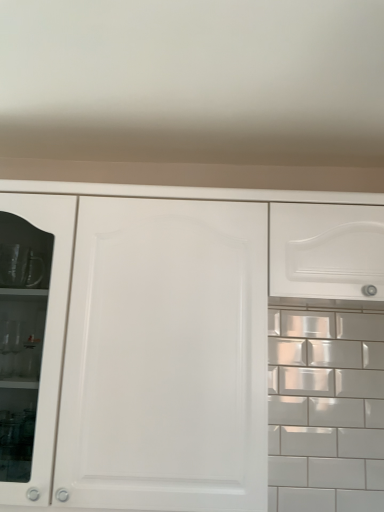
Question: Is white matte cabinet at center inside the boundaries of white glossy drawer at upper right, or outside?

Choices:
 (A) inside
 (B) outside

Answer: (B)

Question: From the image's perspective, is white matte cabinet at center positioned above or below white glossy drawer at upper right?

Choices:
 (A) above
 (B) below

Answer: (B)

Question: In the image, is white matte cabinet at center on the left side or the right side of white glossy drawer at upper right?

Choices:
 (A) right
 (B) left

Answer: (B)

Question: From the image's perspective, is white glossy drawer at upper right located above or below white matte cabinet at center?

Choices:
 (A) above
 (B) below

Answer: (A)

Question: Is white glossy drawer at upper right spatially inside white matte cabinet at center, or outside of it?

Choices:
 (A) inside
 (B) outside

Answer: (B)

Question: Is white glossy drawer at upper right to the left or to the right of white matte cabinet at center in the image?

Choices:
 (A) left
 (B) right

Answer: (B)

Question: Is white glossy drawer at upper right bigger or smaller than white matte cabinet at center?

Choices:
 (A) small
 (B) big

Answer: (A)